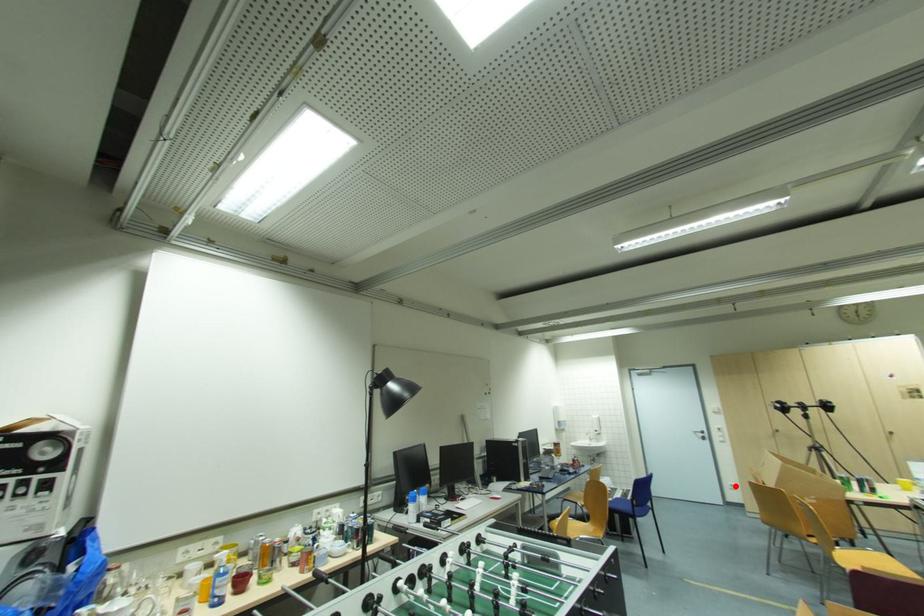
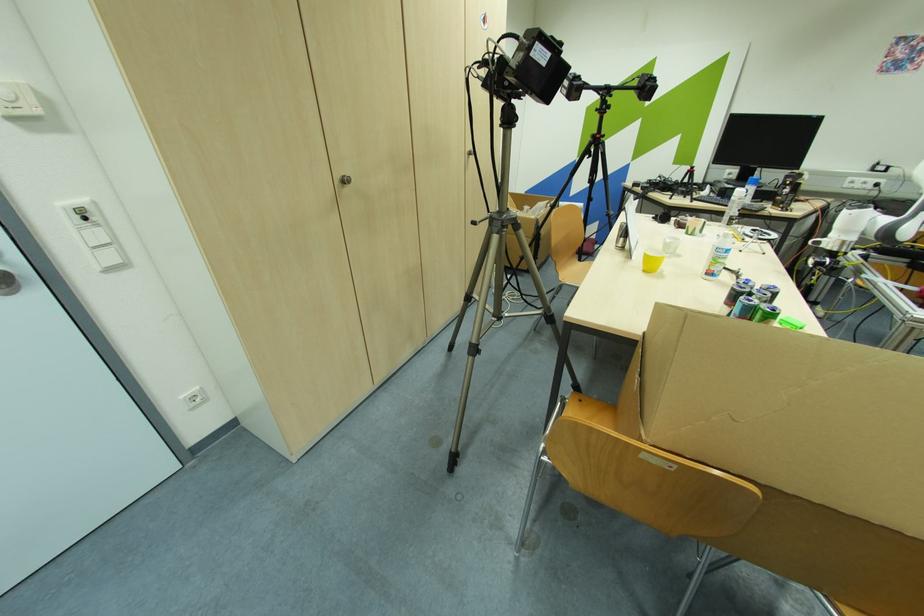
Locate, in the second image, the point that corresponds to the highlighted location in the first image.

(198, 399)